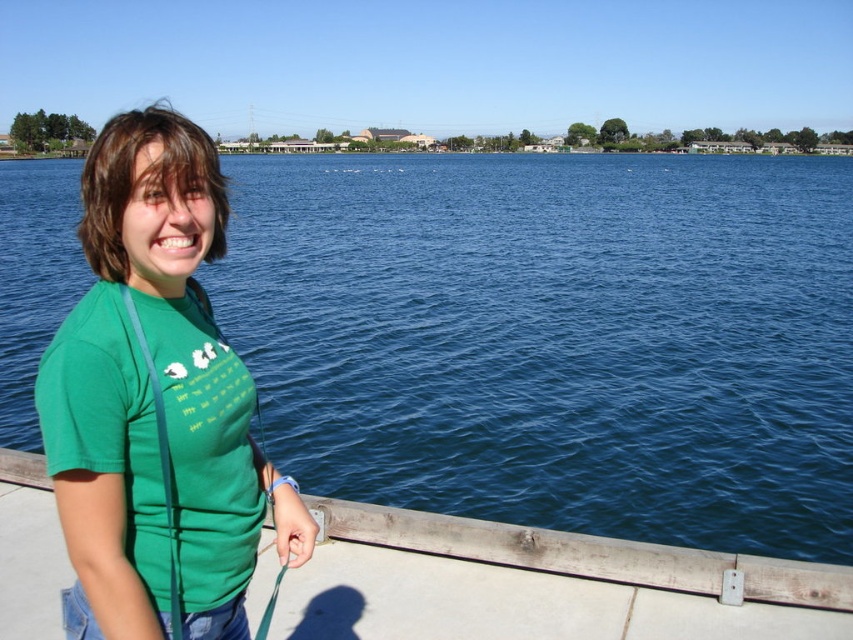
Can you confirm if blue water at center is wider than wooden at lower center?

Yes.

Does blue water at center have a greater height compared to wooden at lower center?

Yes, blue water at center is taller than wooden at lower center.

Describe the element at coordinates (556, 339) in the screenshot. I see `blue water at center` at that location.

Locate an element on the screen. This screenshot has width=853, height=640. blue water at center is located at coordinates (556, 339).

Is green matte shirt at left taller than wooden at lower center?

Yes, green matte shirt at left is taller than wooden at lower center.

Locate an element on the screen. green matte shirt at left is located at coordinates (152, 401).

Is point (83, 600) in front of point (610, 636)?

Yes.

Image resolution: width=853 pixels, height=640 pixels. I want to click on green matte shirt at left, so click(152, 401).

Between blue water at center and green matte shirt at left, which one has less height?

Standing shorter between the two is green matte shirt at left.

Between point (686, 328) and point (178, 564), which one is positioned in front?

Point (178, 564) is more forward.

Is point (381, 339) positioned after point (189, 189)?

Yes.

Where is `blue water at center`? The image size is (853, 640). blue water at center is located at coordinates (556, 339).